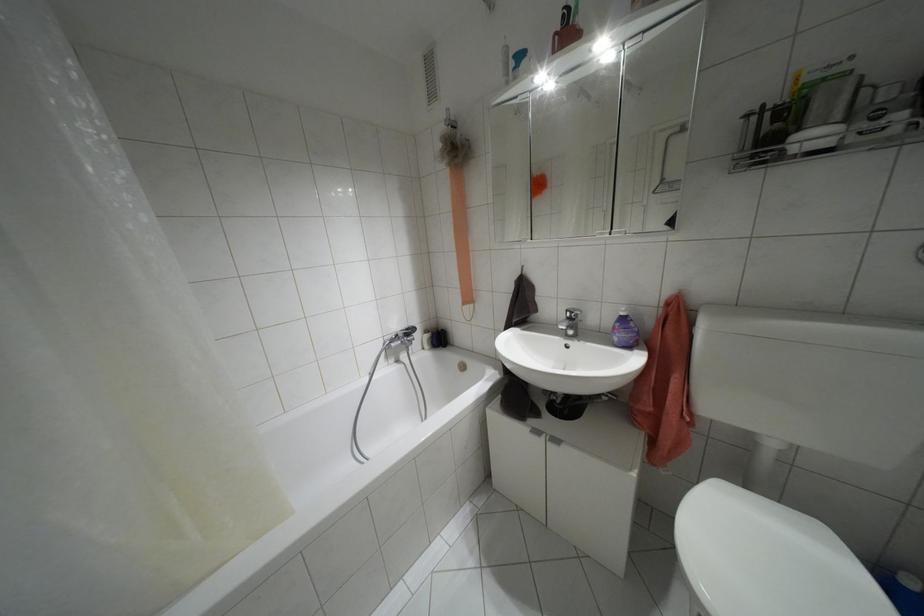
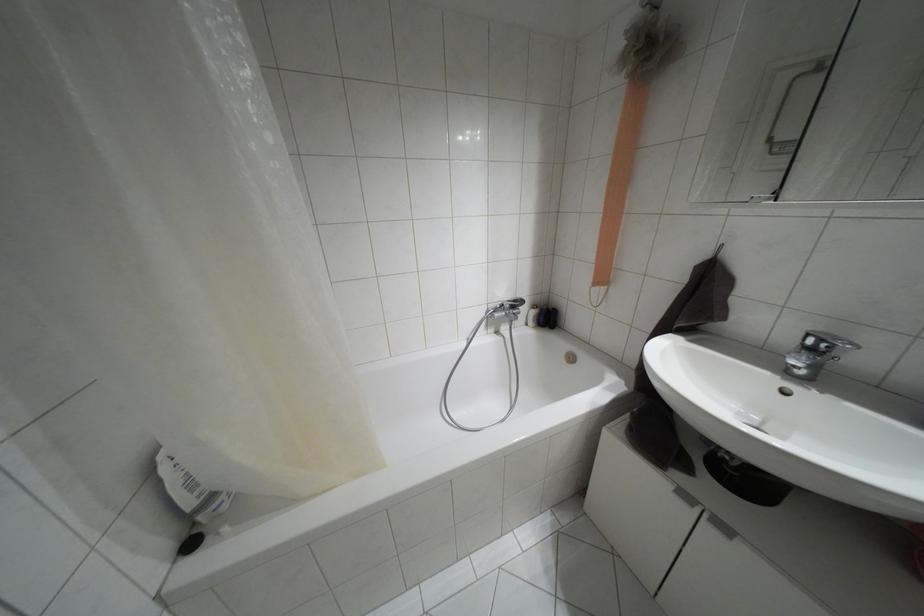
Find the pixel in the second image that matches (555,440) in the first image.

(723, 528)